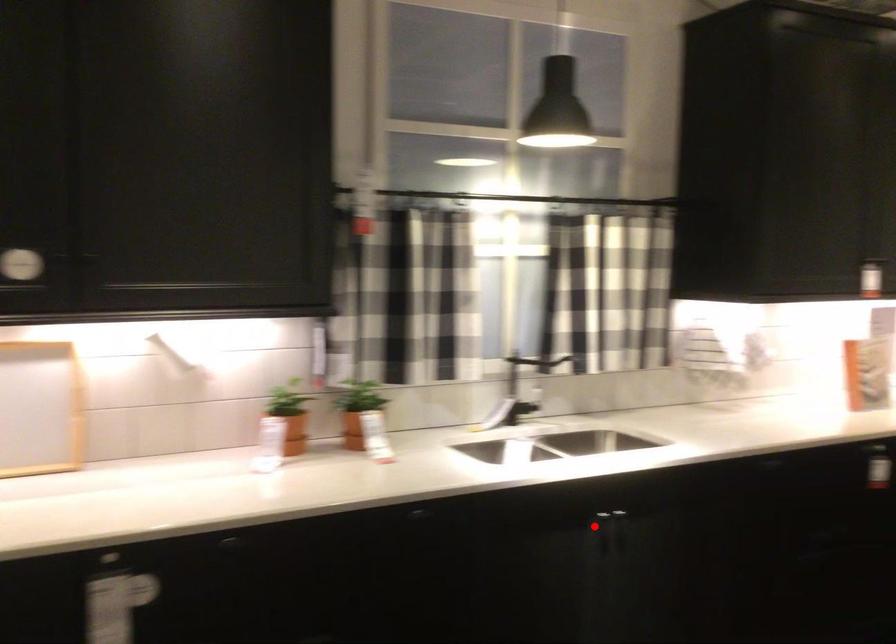
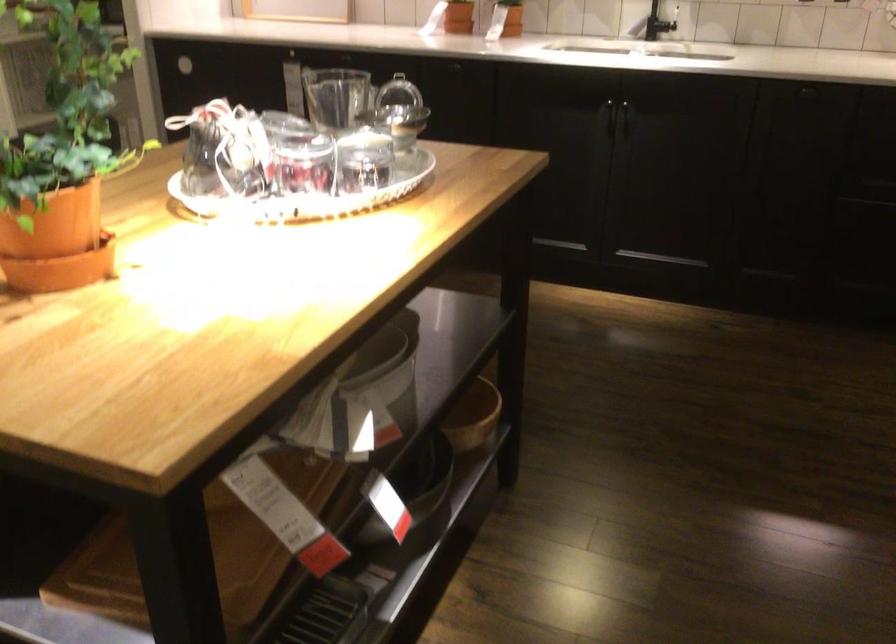
Where in the second image is the point corresponding to the highlighted location from the first image?

(599, 107)